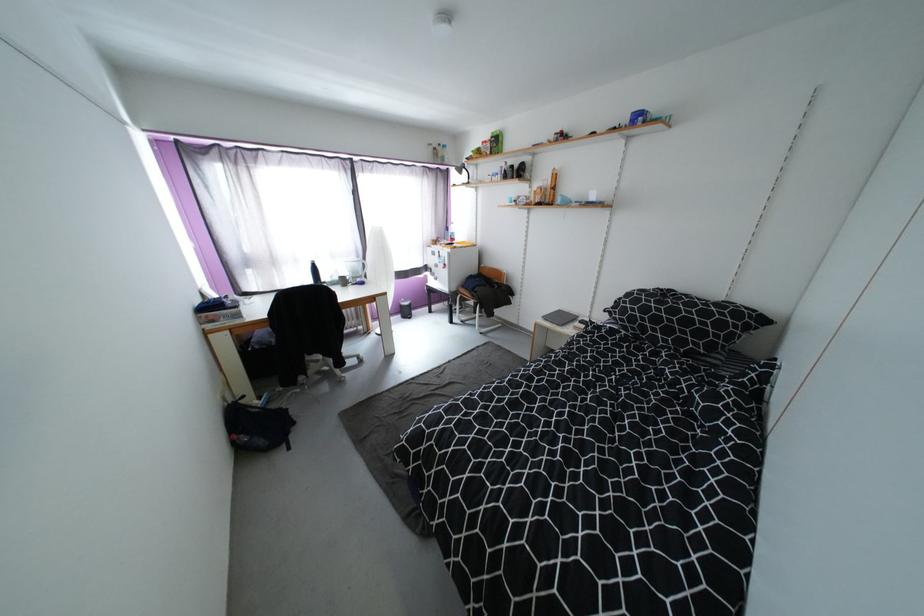
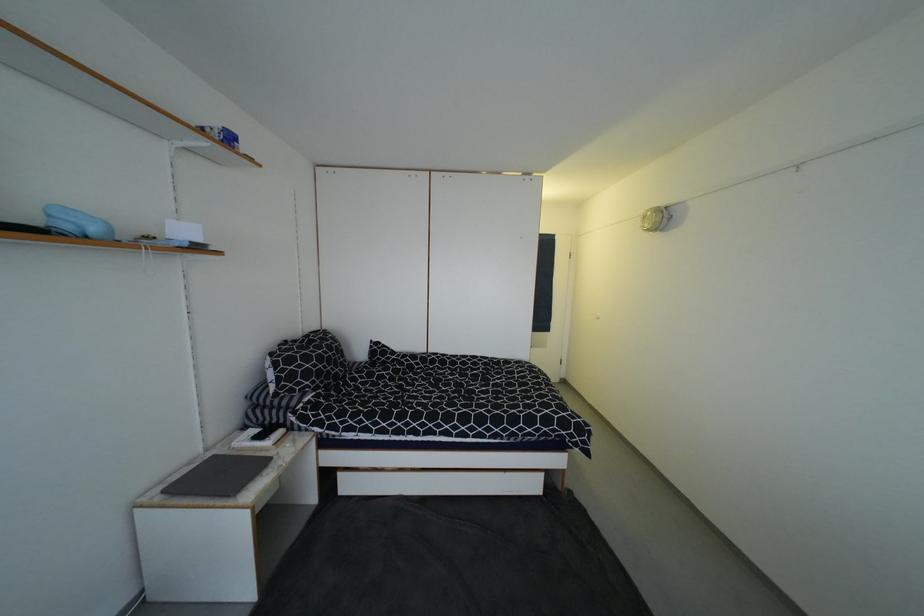
Find the pixel in the second image that matches pixel 565 312 in the first image.

(169, 493)